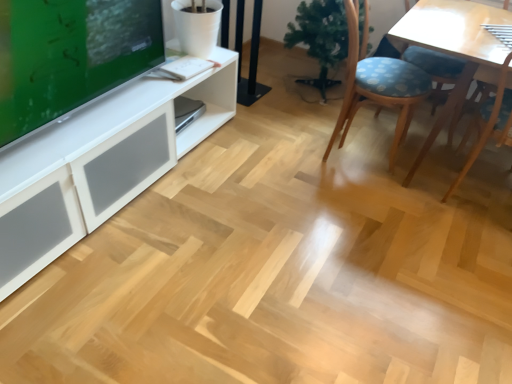
Question: Considering the relative positions of blue fabric chair at center-right and green glossy tv at upper left in the image provided, is blue fabric chair at center-right to the left of green glossy tv at upper left from the viewer's perspective?

Choices:
 (A) yes
 (B) no

Answer: (B)

Question: Is blue fabric chair at center-right wider than green glossy tv at upper left?

Choices:
 (A) no
 (B) yes

Answer: (B)

Question: Is blue fabric chair at center-right bigger than green glossy tv at upper left?

Choices:
 (A) no
 (B) yes

Answer: (B)

Question: Is blue fabric chair at center-right facing away from green glossy tv at upper left?

Choices:
 (A) no
 (B) yes

Answer: (A)

Question: Is blue fabric chair at center-right thinner than green glossy tv at upper left?

Choices:
 (A) yes
 (B) no

Answer: (B)

Question: From the image's perspective, is green matte artificial plant at center above or below blue fabric chair at center-right?

Choices:
 (A) above
 (B) below

Answer: (A)

Question: In terms of width, does green matte artificial plant at center look wider or thinner when compared to blue fabric chair at center-right?

Choices:
 (A) thin
 (B) wide

Answer: (A)

Question: Based on their sizes in the image, would you say green matte artificial plant at center is bigger or smaller than blue fabric chair at center-right?

Choices:
 (A) small
 (B) big

Answer: (A)

Question: Visually, is green matte artificial plant at center positioned to the left or to the right of blue fabric chair at center-right?

Choices:
 (A) left
 (B) right

Answer: (A)

Question: In terms of width, does blue fabric chair at center-right look wider or thinner when compared to green glossy tv at upper left?

Choices:
 (A) thin
 (B) wide

Answer: (B)

Question: From the image's perspective, relative to green glossy tv at upper left, is blue fabric chair at center-right above or below?

Choices:
 (A) above
 (B) below

Answer: (A)

Question: In the image, is blue fabric chair at center-right on the left side or the right side of green glossy tv at upper left?

Choices:
 (A) left
 (B) right

Answer: (B)

Question: From a real-world perspective, is blue fabric chair at center-right above or below green glossy tv at upper left?

Choices:
 (A) below
 (B) above

Answer: (A)

Question: Choose the correct answer: Is green glossy tv at upper left inside blue fabric chair at center-right or outside it?

Choices:
 (A) inside
 (B) outside

Answer: (B)

Question: In terms of width, does green glossy tv at upper left look wider or thinner when compared to blue fabric chair at center-right?

Choices:
 (A) wide
 (B) thin

Answer: (B)